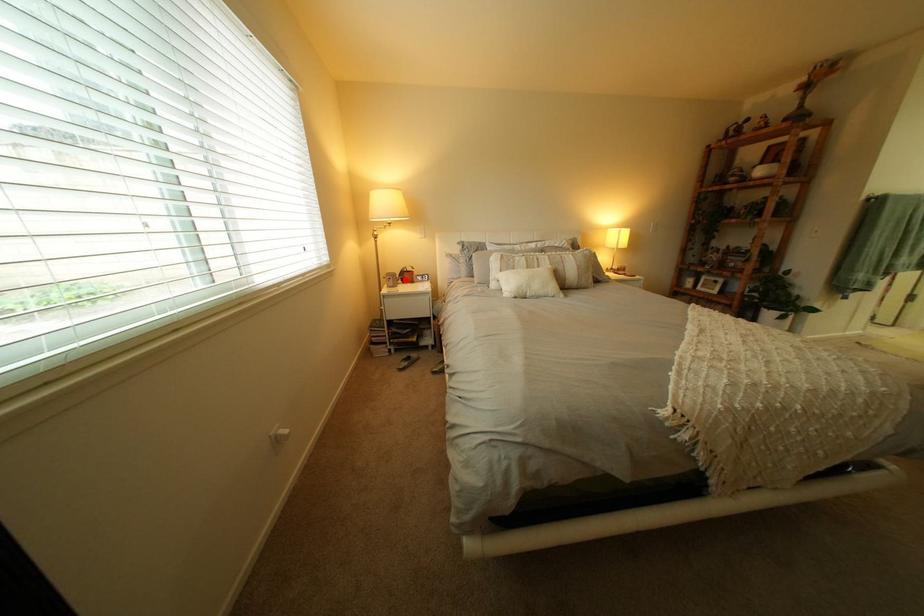
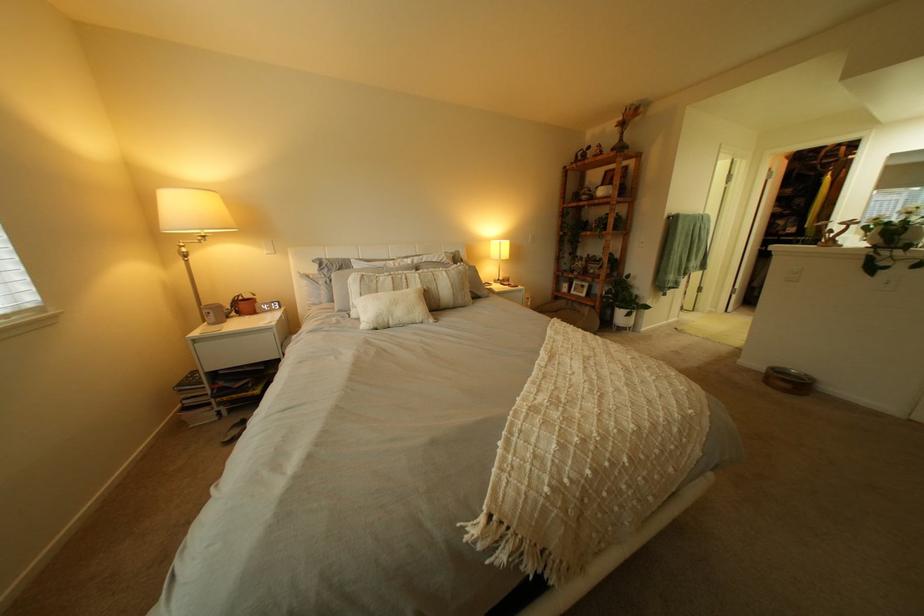
Locate, in the second image, the point that corresponds to the highlighted location in the first image.

(225, 314)